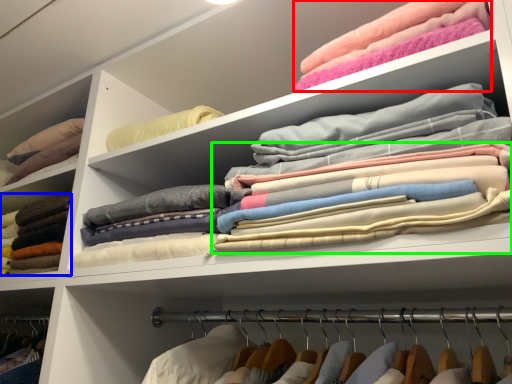
Question: Which object is positioned closest to clothing (highlighted by a red box)? Select from clothing (highlighted by a blue box) and clothing (highlighted by a green box).

Choices:
 (A) clothing
 (B) clothing

Answer: (B)